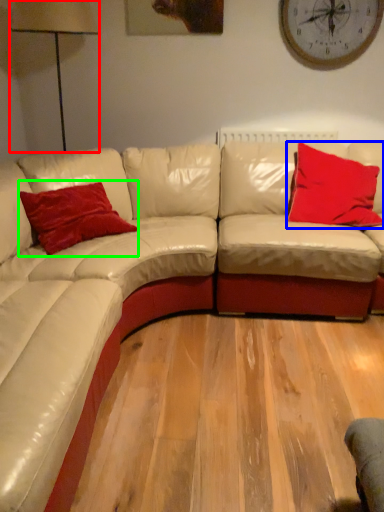
Question: Which object is the farthest from table lamp (highlighted by a red box)? Choose among these: pillow (highlighted by a blue box) or pillow (highlighted by a green box).

Choices:
 (A) pillow
 (B) pillow

Answer: (A)